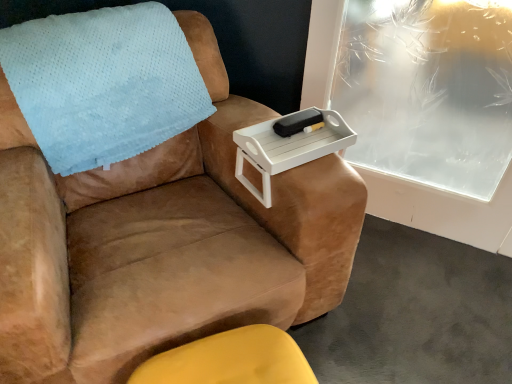
Describe the element at coordinates (297, 122) in the screenshot. This screenshot has width=512, height=384. I see `black matte tray at upper center` at that location.

This screenshot has width=512, height=384. What do you see at coordinates (162, 243) in the screenshot?
I see `suede brown armchair at upper right` at bounding box center [162, 243].

Find the location of `matte yellow ottoman at lower center`. matte yellow ottoman at lower center is located at coordinates (230, 360).

Is light blue fleece blanket at upper left far from matte yellow ottoman at lower center?

No, light blue fleece blanket at upper left is in close proximity to matte yellow ottoman at lower center.

Which is more to the right, light blue fleece blanket at upper left or matte yellow ottoman at lower center?

Positioned to the right is matte yellow ottoman at lower center.

Where is `blanket that appears on the left of matte yellow ottoman at lower center`? blanket that appears on the left of matte yellow ottoman at lower center is located at coordinates (103, 83).

From a real-world perspective, is light blue fleece blanket at upper left located beneath matte yellow ottoman at lower center?

No.

Considering the positions of objects white plastic tray at upper right and matte yellow ottoman at lower center in the image provided, who is more to the left, white plastic tray at upper right or matte yellow ottoman at lower center?

matte yellow ottoman at lower center.

From the image's perspective, is white plastic tray at upper right on matte yellow ottoman at lower center?

Yes.

Could you tell me if white plastic tray at upper right is facing matte yellow ottoman at lower center?

No, white plastic tray at upper right is not facing towards matte yellow ottoman at lower center.

Locate an element on the screen. Image resolution: width=512 pixels, height=384 pixels. chair below the white plastic tray at upper right (from a real-world perspective) is located at coordinates (162, 243).

Consider the image. Is suede brown armchair at upper right aimed at white plastic tray at upper right?

No.

Is suede brown armchair at upper right positioned before white plastic tray at upper right?

Yes.

Is suede brown armchair at upper right not within white plastic tray at upper right?

Indeed, suede brown armchair at upper right is completely outside white plastic tray at upper right.

From a real-world perspective, which is physically below, matte yellow ottoman at lower center or frosted glass tray at upper right?

matte yellow ottoman at lower center is physically lower.

Which is in front, matte yellow ottoman at lower center or frosted glass tray at upper right?

matte yellow ottoman at lower center.

Is matte yellow ottoman at lower center in contact with frosted glass tray at upper right?

matte yellow ottoman at lower center is not next to frosted glass tray at upper right, and they're not touching.

From the image's perspective, is matte yellow ottoman at lower center positioned above or below frosted glass tray at upper right?

Based on their image positions, matte yellow ottoman at lower center is located beneath frosted glass tray at upper right.

Is light blue fleece blanket at upper left looking in the opposite direction of black matte tray at upper center?

No, light blue fleece blanket at upper left is not facing away from black matte tray at upper center.

Is light blue fleece blanket at upper left in front of or behind black matte tray at upper center in the image?

light blue fleece blanket at upper left is in front of black matte tray at upper center.

From the image's perspective, is light blue fleece blanket at upper left under black matte tray at upper center?

No.

Based on the photo, does light blue fleece blanket at upper left contain black matte tray at upper center?

No, black matte tray at upper center is not inside light blue fleece blanket at upper left.

How much distance is there between light blue fleece blanket at upper left and frosted glass tray at upper right?

4.95 feet.

How many degrees apart are the facing directions of light blue fleece blanket at upper left and frosted glass tray at upper right?

They differ by 52.2 degrees in their facing directions.

From the image's perspective, which object appears higher, light blue fleece blanket at upper left or frosted glass tray at upper right?

light blue fleece blanket at upper left is shown above in the image.

Is light blue fleece blanket at upper left positioned with its back to frosted glass tray at upper right?

No, light blue fleece blanket at upper left is not facing away from frosted glass tray at upper right.

I want to click on table that appears on the left of black matte tray at upper center, so click(287, 148).

From a real-world perspective, is white plastic tray at upper right over black matte tray at upper center?

No, from a real-world perspective, white plastic tray at upper right is not over black matte tray at upper center

Is white plastic tray at upper right aimed at black matte tray at upper center?

No.

In the image, is white plastic tray at upper right on the left side or the right side of black matte tray at upper center?

Clearly, white plastic tray at upper right is on the left of black matte tray at upper center in the image.

The height and width of the screenshot is (384, 512). I want to click on blanket behind the matte yellow ottoman at lower center, so click(x=103, y=83).

What are the coordinates of `furniture located below the white plastic tray at upper right (from the image's perspective)` in the screenshot? It's located at (230, 360).

Looking at this image, based on their spatial positions, is suede brown armchair at upper right or frosted glass tray at upper right further from matte yellow ottoman at lower center?

frosted glass tray at upper right is further to matte yellow ottoman at lower center.

Based on their spatial positions, is white plastic tray at upper right or matte yellow ottoman at lower center further from suede brown armchair at upper right?

matte yellow ottoman at lower center is further to suede brown armchair at upper right.

Which object lies nearer to the anchor point white plastic tray at upper right, suede brown armchair at upper right or black matte tray at upper center?

black matte tray at upper center is positioned closer to the anchor white plastic tray at upper right.

Estimate the real-world distances between objects in this image. Which object is further from suede brown armchair at upper right, frosted glass tray at upper right or black matte tray at upper center?

frosted glass tray at upper right.

Considering their positions, is black matte tray at upper center positioned further to light blue fleece blanket at upper left than matte yellow ottoman at lower center?

matte yellow ottoman at lower center is positioned further to the anchor light blue fleece blanket at upper left.

From the picture: When comparing their distances from white plastic tray at upper right, does black matte tray at upper center or frosted glass tray at upper right seem closer?

black matte tray at upper center.

Considering their positions, is black matte tray at upper center positioned closer to matte yellow ottoman at lower center than white plastic tray at upper right?

white plastic tray at upper right is positioned closer to the anchor matte yellow ottoman at lower center.

Based on their spatial positions, is suede brown armchair at upper right or light blue fleece blanket at upper left closer to matte yellow ottoman at lower center?

suede brown armchair at upper right.

Find the location of `table between light blue fleece blanket at upper left and black matte tray at upper center in the horizontal direction`. table between light blue fleece blanket at upper left and black matte tray at upper center in the horizontal direction is located at coordinates (287, 148).

Find the location of a particular element. The image size is (512, 384). furniture between light blue fleece blanket at upper left and frosted glass tray at upper right in the horizontal direction is located at coordinates (230, 360).

Identify the location of table between frosted glass tray at upper right and matte yellow ottoman at lower center in the up-down direction. (287, 148).

Identify the location of pad between light blue fleece blanket at upper left and matte yellow ottoman at lower center in the up-down direction. (297, 122).